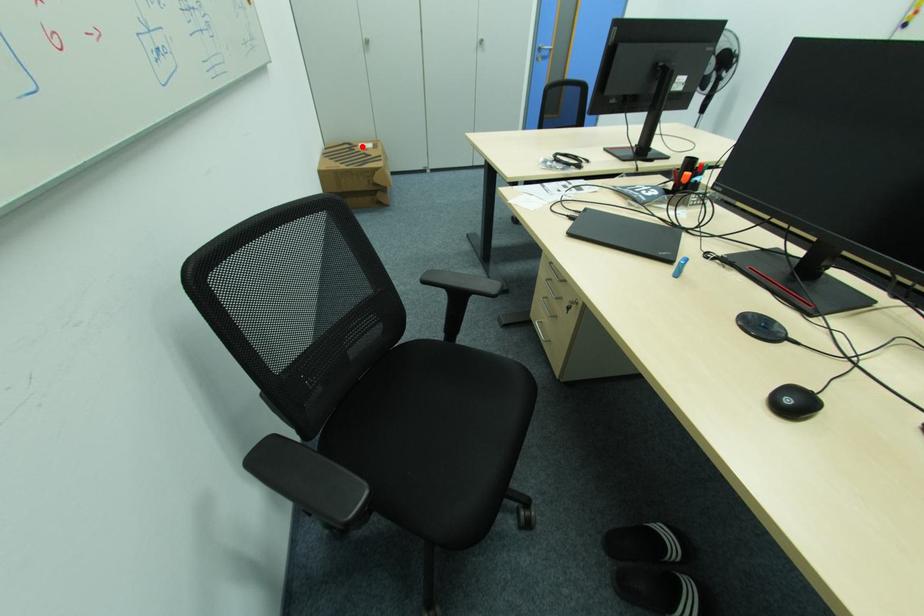
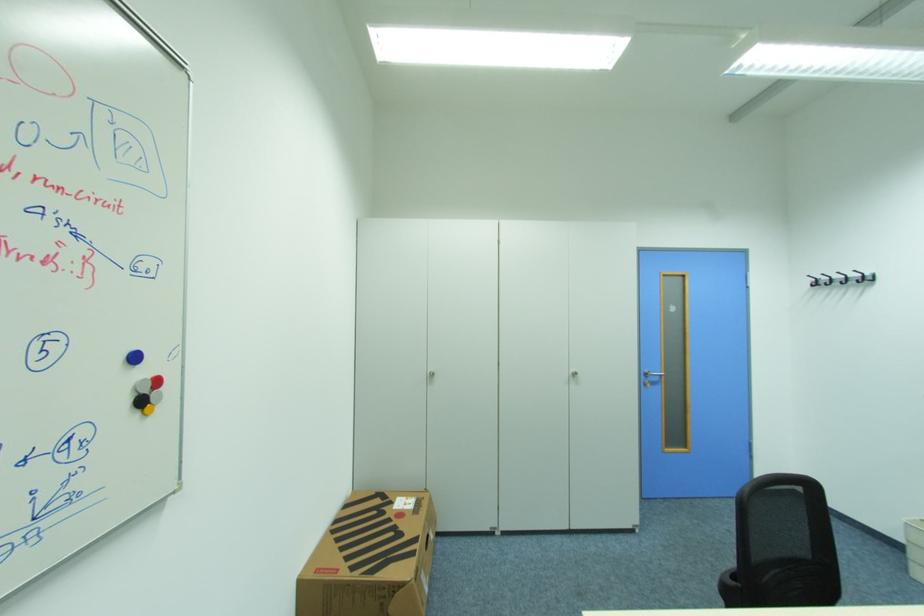
Question: I am providing you with two images of the same scene from different viewpoints. A red point is marked on the first image. At the location where the point appears in image 1, is it still visible in image 2?

Choices:
 (A) Yes
 (B) No

Answer: (A)